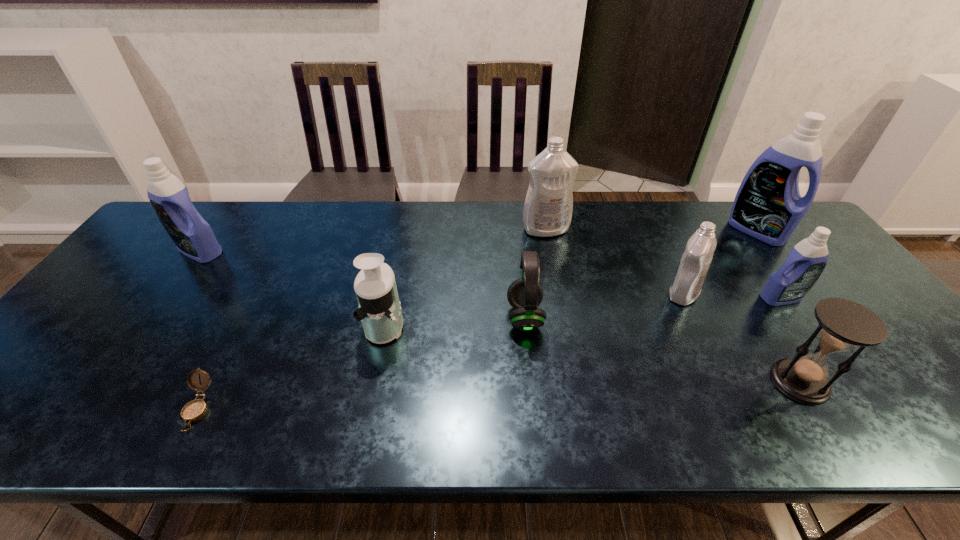
This screenshot has width=960, height=540. Identify the location of the fourth closest object relative to the hourglass. (525, 294).

Locate an element on the screen. Image resolution: width=960 pixels, height=540 pixels. the closest object to the smallest blue detergent is located at coordinates 691,272.

Select which detergent is the second closest to the leftmost blue detergent. Please provide its 2D coordinates. Your answer should be formatted as a tuple, i.e. [(x, y)], where the tuple contains the x and y coordinates of a point satisfying the conditions above.

[(691, 272)]

Choose which detergent is the third nearest neighbor to the bigger white detergent. Please provide its 2D coordinates. Your answer should be formatted as a tuple, i.e. [(x, y)], where the tuple contains the x and y coordinates of a point satisfying the conditions above.

[(806, 261)]

The height and width of the screenshot is (540, 960). In order to click on blue detergent that is the closest to the third detergent from right to left in this screenshot , I will do `click(806, 261)`.

Locate an element on the screen. blue detergent that is the third closest to the right white detergent is located at coordinates (192, 235).

I want to click on free location that satisfies the following two spatial constraints: 1. on the ear cups of the black headset; 2. on the back side of the hourglass, so click(532, 382).

Find the location of a particular element. The width and height of the screenshot is (960, 540). vacant space that satisfies the following two spatial constraints: 1. on the front side of the farther white detergent; 2. on the ear cups of the black headset is located at coordinates (562, 317).

Find the location of a particular element. The image size is (960, 540). free spot that satisfies the following two spatial constraints: 1. on the front side of the nearer white detergent; 2. on the ear cups of the headset is located at coordinates (694, 317).

I want to click on vacant region that satisfies the following two spatial constraints: 1. on the front side of the black hourglass; 2. on the left side of the leftmost object, so click(x=106, y=382).